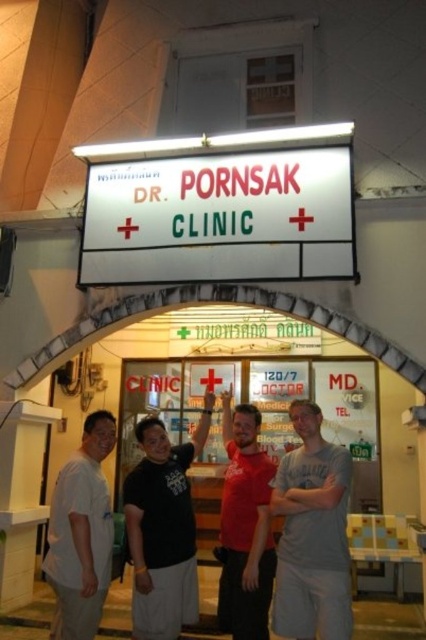
Question: Can you confirm if white matte shirt at left is bigger than red matte shirt at center?

Choices:
 (A) no
 (B) yes

Answer: (A)

Question: Can you confirm if black cotton shirt at center is positioned to the right of white matte shirt at left?

Choices:
 (A) no
 (B) yes

Answer: (B)

Question: Which object is positioned closest to the white plastic sign at center?

Choices:
 (A) gray cotton t-shirt at center
 (B) black cotton shirt at center
 (C) red matte shirt at center

Answer: (C)

Question: Which of the following is the farthest from the observer?

Choices:
 (A) red matte shirt at center
 (B) gray cotton t-shirt at center
 (C) white matte shirt at left
 (D) white plastic sign at center

Answer: (D)

Question: Which object is closer to the camera taking this photo?

Choices:
 (A) white plastic sign at center
 (B) white matte shirt at left

Answer: (B)

Question: Does white plastic sign at center have a lesser width compared to red matte shirt at center?

Choices:
 (A) no
 (B) yes

Answer: (A)